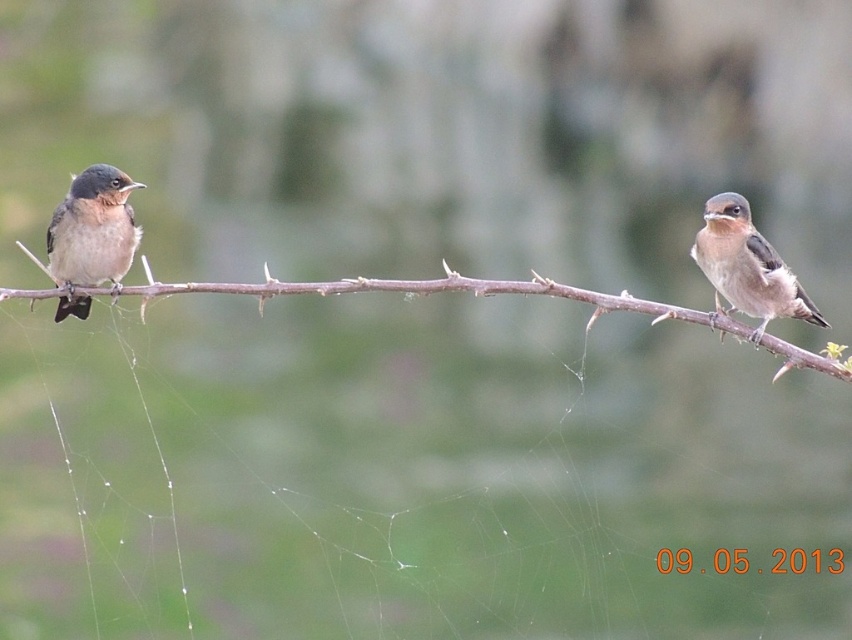
You are a birdwatcher observing two brown matte birds on a branch. Which bird is closer to you, the brown matte bird at left or the brown matte bird at right?

The brown matte bird at left is closer to you because it is further to the viewer than the brown matte bird at right.

You are a birdwatcher observing the scene. You notice the brown textured branch at center and the brown matte bird at left. Which object is bigger in size?

The brown textured branch at center is larger in size compared to the brown matte bird at left.

You are a birdwatcher trying to identify the species of the two birds in the image. You notice the brown matte bird at right is smaller than the brown textured branch at center. Does this size difference help you determine if they are the same species?

The brown textured branch at center is bigger than the brown matte bird at right, but size alone cannot determine species as birds vary in size within the same species and the branch is not a bird. You need more characteristics like plumage patterns or behavior.